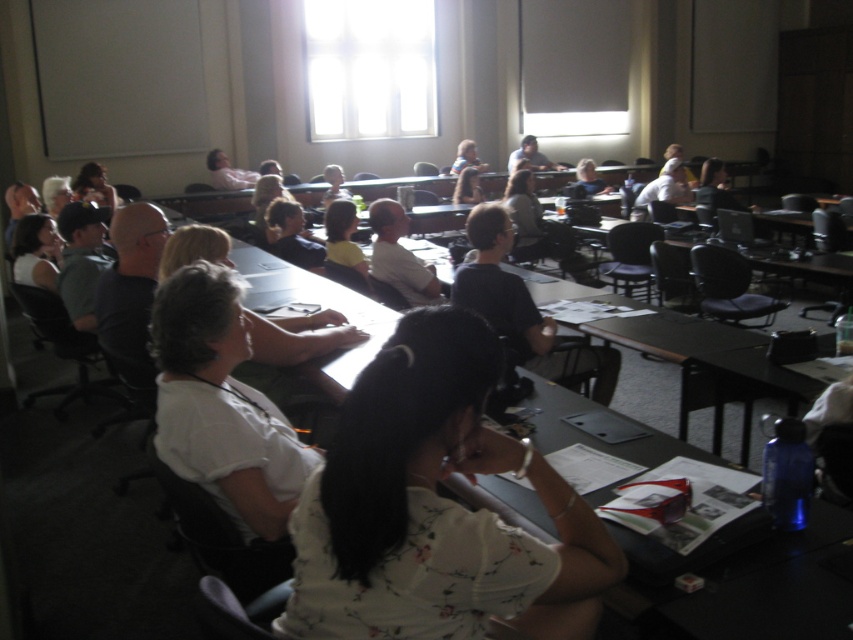
Question: Which is farther from the white floral shirt at center?

Choices:
 (A) matte black laptop at center
 (B) matte white shirt at upper left

Answer: (A)

Question: Does white floral shirt at center appear over matte black laptop at center?

Choices:
 (A) no
 (B) yes

Answer: (A)

Question: Which is nearer to the white floral shirt at center?

Choices:
 (A) matte black laptop at center
 (B) matte white shirt at upper left

Answer: (B)

Question: Does white floral shirt at center appear on the left side of matte white shirt at upper left?

Choices:
 (A) yes
 (B) no

Answer: (B)

Question: Can you confirm if white floral shirt at center is positioned to the left of matte white shirt at upper left?

Choices:
 (A) no
 (B) yes

Answer: (A)

Question: Estimate the real-world distances between objects in this image. Which object is closer to the matte white shirt at upper left?

Choices:
 (A) matte black laptop at center
 (B) white floral shirt at center

Answer: (B)